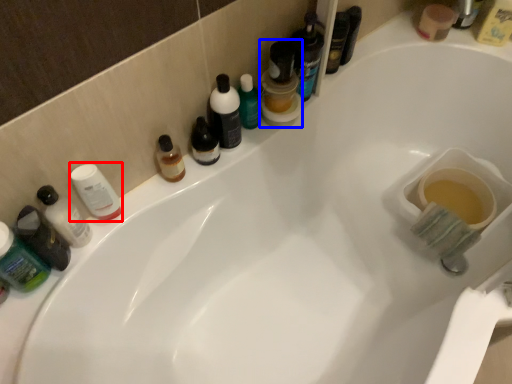
Question: Which object is further to the camera taking this photo, toiletry (highlighted by a red box) or mouthwash (highlighted by a blue box)?

Choices:
 (A) toiletry
 (B) mouthwash

Answer: (B)